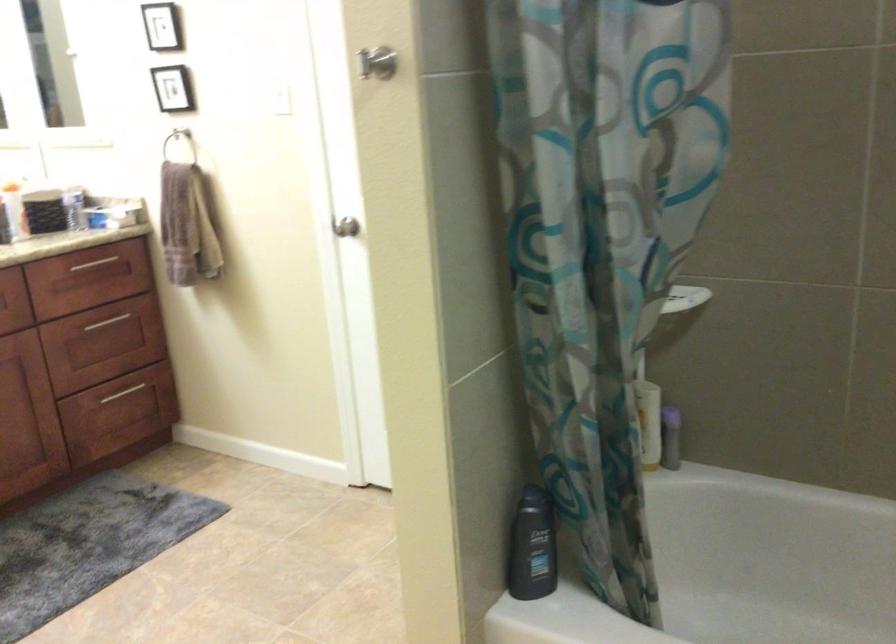
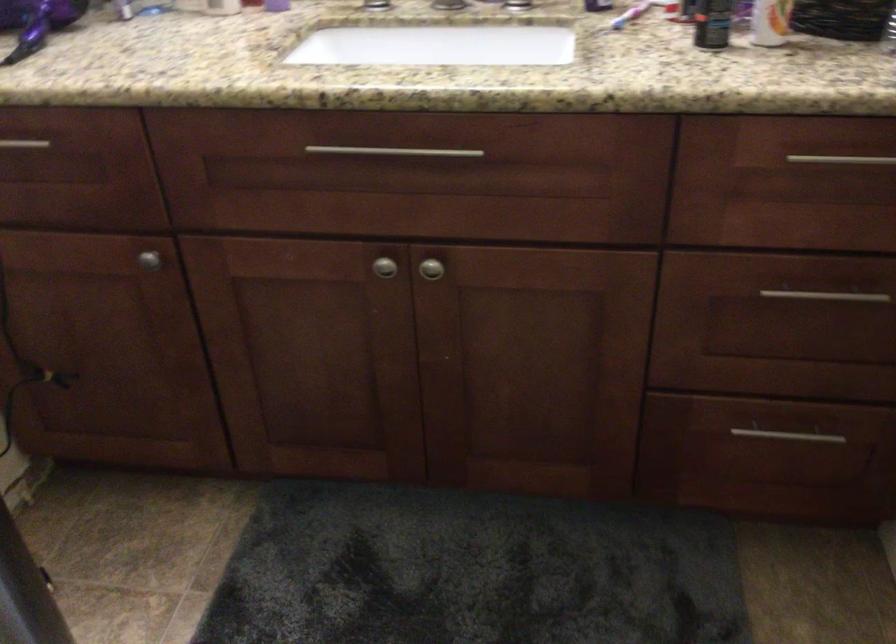
Where in the second image is the point corresponding to point 125,401 from the first image?

(778, 446)